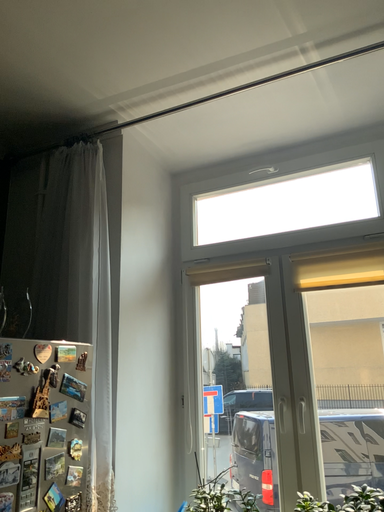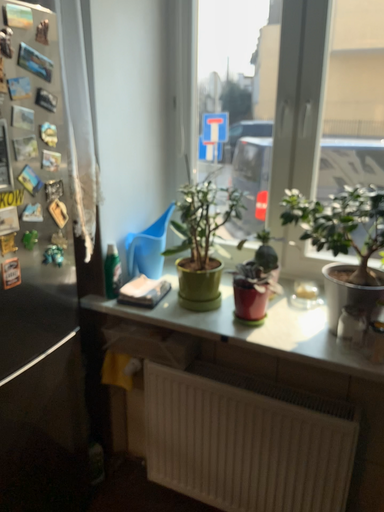
Question: Which way did the camera rotate in the video?

Choices:
 (A) rotated downward
 (B) rotated upward

Answer: (A)